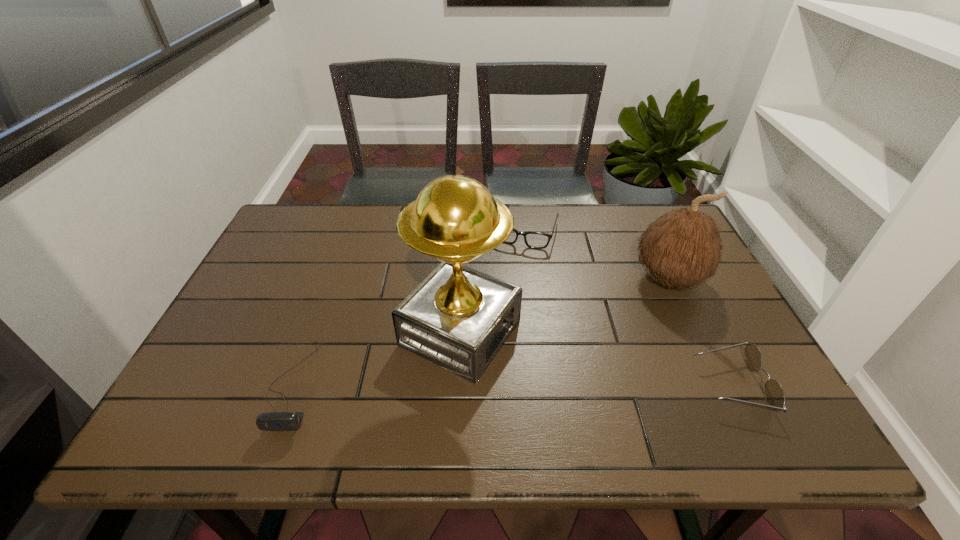
Where is `vacant space located 0.180m on the surface of the coconut`? The width and height of the screenshot is (960, 540). vacant space located 0.180m on the surface of the coconut is located at coordinates (609, 330).

Where is `vacant region located 0.390m on the surface of the coconut`? The width and height of the screenshot is (960, 540). vacant region located 0.390m on the surface of the coconut is located at coordinates (552, 378).

What are the coordinates of `free space located on the front-facing side of the award` in the screenshot? It's located at (534, 366).

The width and height of the screenshot is (960, 540). Identify the location of vacant space situated 0.160m on the front-facing side of the award. (580, 387).

Locate an element on the screen. blank space located 0.070m on the front-facing side of the award is located at coordinates (542, 370).

I want to click on free point located 0.240m on the front-facing side of the left spectacles, so click(495, 304).

At what (x,y) coordinates should I click in order to perform the action: click on vacant area situated 0.110m on the front-facing side of the left spectacles. Please return your answer as a coordinate pair (x, y). This screenshot has width=960, height=540. Looking at the image, I should click on pyautogui.click(x=508, y=273).

Find the location of a particular element. Image resolution: width=960 pixels, height=540 pixels. free space located on the front-facing side of the left spectacles is located at coordinates (502, 287).

Where is `object that is at the far edge`? Image resolution: width=960 pixels, height=540 pixels. object that is at the far edge is located at coordinates (536, 240).

The height and width of the screenshot is (540, 960). In order to click on webcam present at the near edge in this screenshot , I will do `click(272, 421)`.